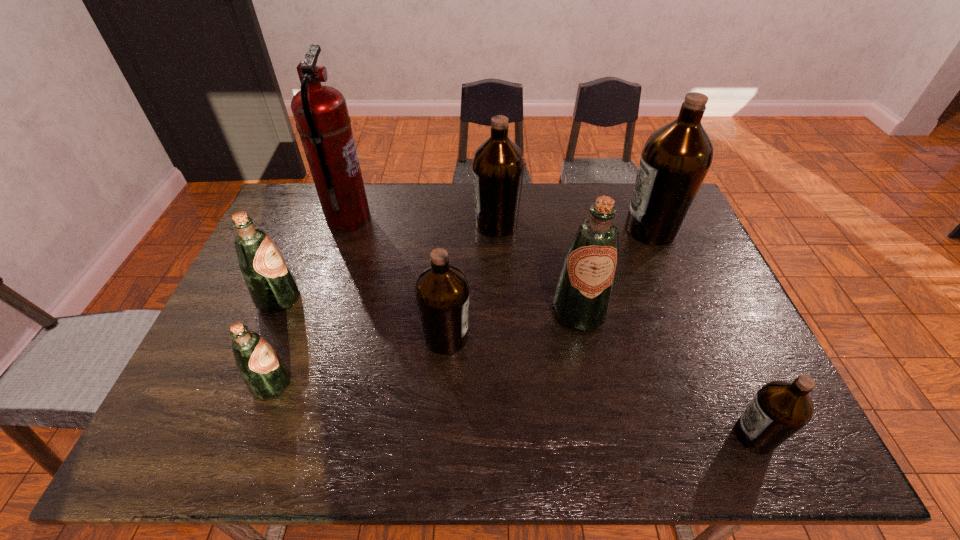
The width and height of the screenshot is (960, 540). Identify the location of vacant area situated on the front-facing side of the second biggest green olive oil. (365, 299).

I want to click on vacant space located on the label of the third farthest brown olive oil, so click(x=577, y=338).

Where is `vacant space located on the front-facing side of the second nearest object`? vacant space located on the front-facing side of the second nearest object is located at coordinates (374, 384).

Locate an element on the screen. The width and height of the screenshot is (960, 540). free space located 0.350m on the label of the nearest brown olive oil is located at coordinates (574, 435).

Find the location of a particular element. Image resolution: width=960 pixels, height=540 pixels. vacant area situated 0.060m on the label of the nearest brown olive oil is located at coordinates (706, 435).

You are a GUI agent. You are given a task and a screenshot of the screen. Output one action in this format:
    pyautogui.click(x=<x>, y=<y>)
    Task: Click on the vacant point located on the label of the nearest brown olive oil
    
    Given the screenshot: What is the action you would take?
    pyautogui.click(x=602, y=435)

You are a GUI agent. You are given a task and a screenshot of the screen. Output one action in this format:
    pyautogui.click(x=<x>, y=<y>)
    Task: Click on the fire extinguisher that is positioned at the far edge
    
    Given the screenshot: What is the action you would take?
    tap(322, 120)

This screenshot has height=540, width=960. In order to click on object situated at the near edge in this screenshot , I will do `click(780, 408)`.

Find the location of `object at the far right corner`. object at the far right corner is located at coordinates (675, 160).

Locate an element on the screen. object that is at the near right corner is located at coordinates point(780,408).